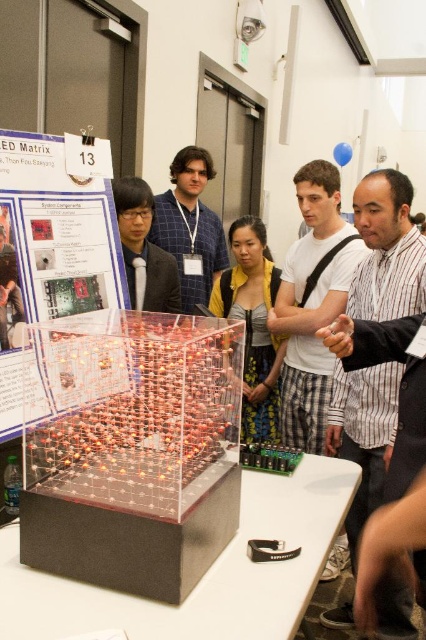
Question: Among these points, which one is farthest from the camera?

Choices:
 (A) (189, 163)
 (B) (278, 278)

Answer: (A)

Question: Which point is farther to the camera?

Choices:
 (A) clear plastic poster at center
 (B) yellow fabric dress at center
 (C) matte black suit at center
 (D) white matte table at center

Answer: (B)

Question: Which object is farther from the camera taking this photo?

Choices:
 (A) clear plastic poster at center
 (B) matte black suit at center

Answer: (B)

Question: Is transparent acrylic cube at center positioned before yellow fabric dress at center?

Choices:
 (A) yes
 (B) no

Answer: (A)

Question: Is transparent acrylic cube at center positioned in front of blue plaid shirt at center?

Choices:
 (A) no
 (B) yes

Answer: (B)

Question: Is blue plaid shirt at center behind matte black suit at center?

Choices:
 (A) yes
 (B) no

Answer: (A)